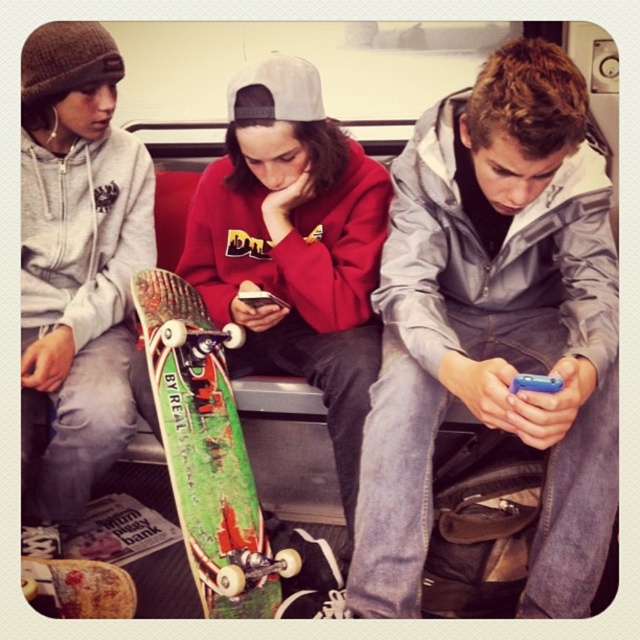
Is silver metallic jacket at center taller than green painted wood skateboard at center?

Indeed, silver metallic jacket at center has a greater height compared to green painted wood skateboard at center.

At what (x,y) coordinates should I click in order to perform the action: click on silver metallic jacket at center. Please return your answer as a coordinate pair (x, y). Image resolution: width=640 pixels, height=640 pixels. Looking at the image, I should click on (496, 326).

Does point (570, 477) come behind point (195, 432)?

No.

The height and width of the screenshot is (640, 640). In order to click on silver metallic jacket at center in this screenshot , I will do `click(496, 326)`.

Can you confirm if green painted wood skateboard at center is smaller than green wooden skateboard at lower left?

No.

Who is taller, green painted wood skateboard at center or green wooden skateboard at lower left?

green painted wood skateboard at center is taller.

The width and height of the screenshot is (640, 640). In order to click on green painted wood skateboard at center in this screenshot , I will do `click(208, 451)`.

Is silver metallic jacket at center shorter than green wooden skateboard at lower left?

Incorrect, silver metallic jacket at center's height does not fall short of green wooden skateboard at lower left's.

Is silver metallic jacket at center further to camera compared to green wooden skateboard at lower left?

That is False.

Where is `silver metallic jacket at center`? silver metallic jacket at center is located at coordinates (496, 326).